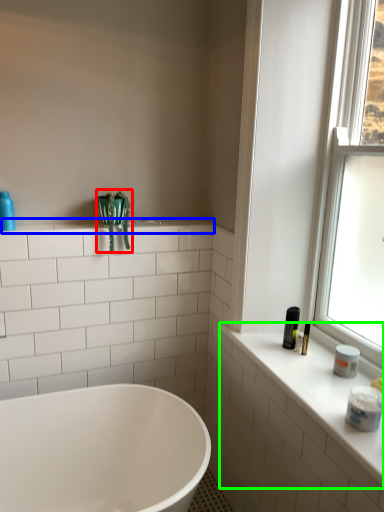
Question: Considering the real-world distances, which object is farthest from plant (highlighted by a red box)? window sill (highlighted by a blue box) or counter top (highlighted by a green box)?

Choices:
 (A) window sill
 (B) counter top

Answer: (B)